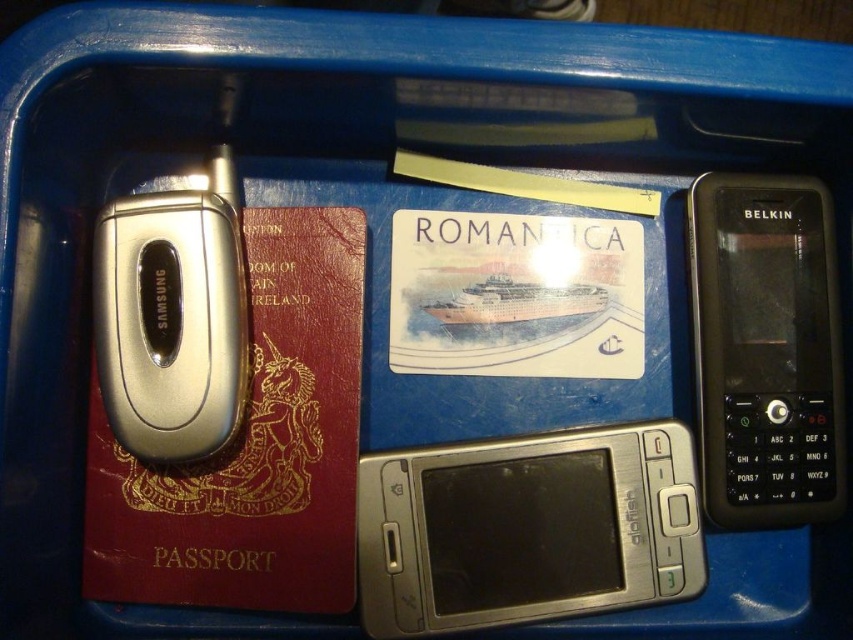
Question: Which point appears closest to the camera in this image?

Choices:
 (A) (181, 289)
 (B) (784, 332)
 (C) (543, 467)

Answer: (A)

Question: Can you confirm if silver metallic smartphone at center is positioned below silver metallic samsung phone at left?

Choices:
 (A) yes
 (B) no

Answer: (A)

Question: Is silver metallic smartphone at center positioned behind black plastic phone at right?

Choices:
 (A) yes
 (B) no

Answer: (B)

Question: Which point is farther to the camera?

Choices:
 (A) (131, 385)
 (B) (659, 525)

Answer: (B)

Question: Is silver metallic smartphone at center to the left of silver metallic samsung phone at left from the viewer's perspective?

Choices:
 (A) no
 (B) yes

Answer: (A)

Question: Based on their relative distances, which object is nearer to the black plastic phone at right?

Choices:
 (A) silver metallic smartphone at center
 (B) silver metallic samsung phone at left

Answer: (A)